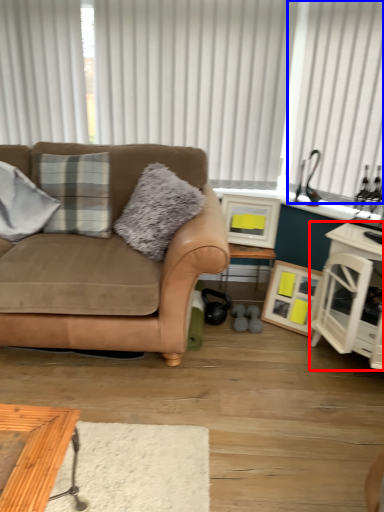
Question: Among these objects, which one is nearest to the camera, cabinetry (highlighted by a red box) or curtain (highlighted by a blue box)?

Choices:
 (A) cabinetry
 (B) curtain

Answer: (A)